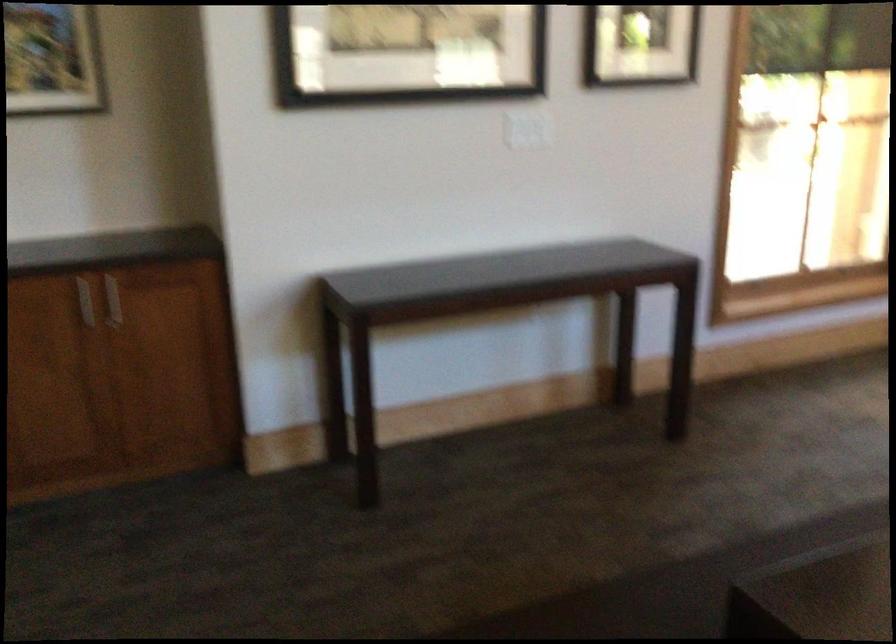
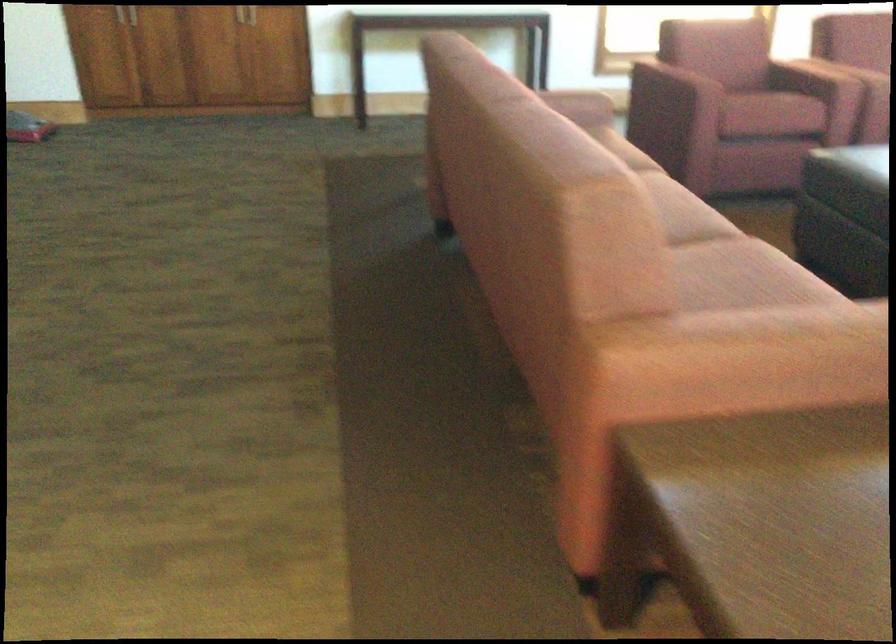
Which direction would the cameraman need to move to produce the second image?

The cameraman moved toward right, backward.